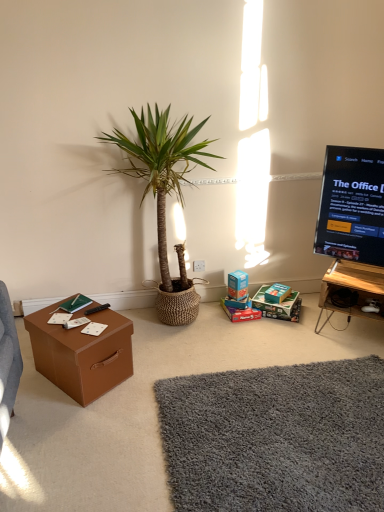
Identify the location of free spot below green woven pot at center (from a real-world perspective). point(157,328).